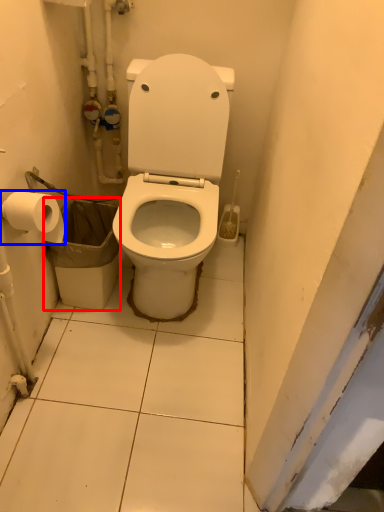
Question: Which point is closer to the camera, garbage (highlighted by a red box) or toilet paper (highlighted by a blue box)?

Choices:
 (A) garbage
 (B) toilet paper

Answer: (B)